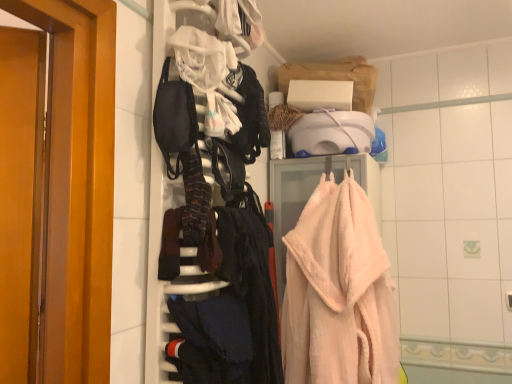
Question: Visually, is fluffy pink towel at right positioned to the left or to the right of dark blue fabric at lower center?

Choices:
 (A) right
 (B) left

Answer: (A)

Question: From a real-world perspective, relative to dark blue fabric at lower center, is fluffy pink towel at right vertically above or below?

Choices:
 (A) below
 (B) above

Answer: (B)

Question: Considering the positions of fluffy pink towel at right and dark blue fabric at lower center in the image, is fluffy pink towel at right bigger or smaller than dark blue fabric at lower center?

Choices:
 (A) big
 (B) small

Answer: (A)

Question: Based on their sizes in the image, would you say dark blue fabric at lower center is bigger or smaller than fluffy pink towel at right?

Choices:
 (A) big
 (B) small

Answer: (B)

Question: From a real-world perspective, is dark blue fabric at lower center above or below fluffy pink towel at right?

Choices:
 (A) above
 (B) below

Answer: (B)

Question: Considering the positions of dark blue fabric at lower center and fluffy pink towel at right in the image, is dark blue fabric at lower center taller or shorter than fluffy pink towel at right?

Choices:
 (A) tall
 (B) short

Answer: (B)

Question: Looking at their shapes, would you say dark blue fabric at lower center is wider or thinner than fluffy pink towel at right?

Choices:
 (A) wide
 (B) thin

Answer: (B)